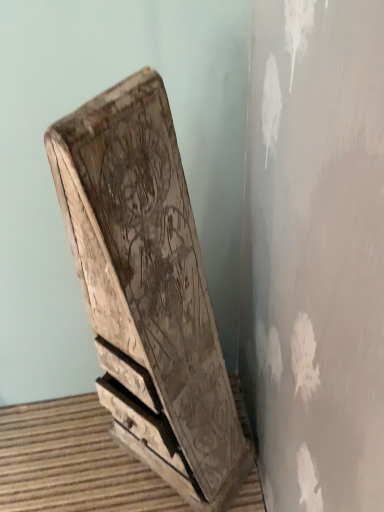
Image resolution: width=384 pixels, height=512 pixels. What do you see at coordinates (148, 291) in the screenshot?
I see `weathered wood sign at center` at bounding box center [148, 291].

Where is `weathered wood sign at center`? weathered wood sign at center is located at coordinates (148, 291).

Identify the location of weathered wood sign at center. The image size is (384, 512). (148, 291).